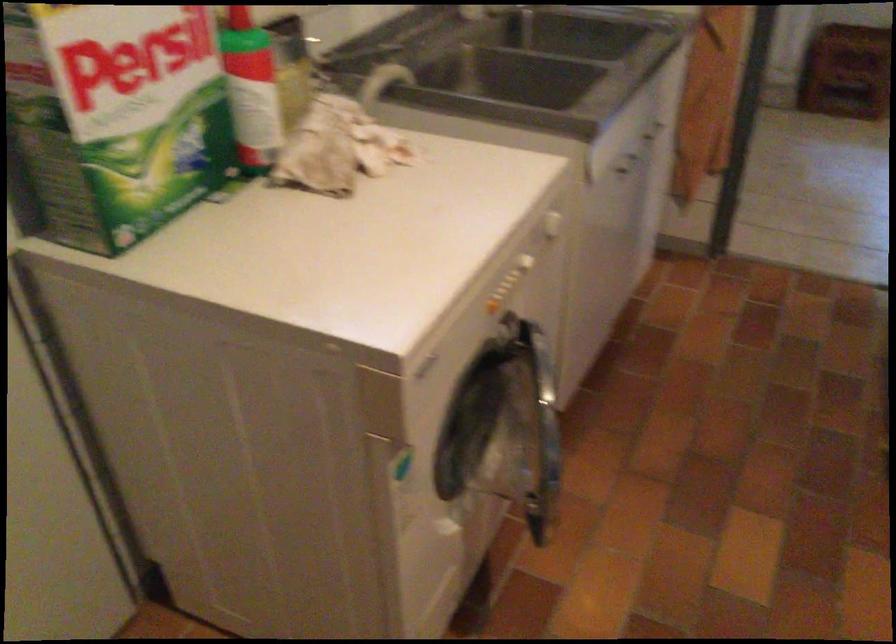
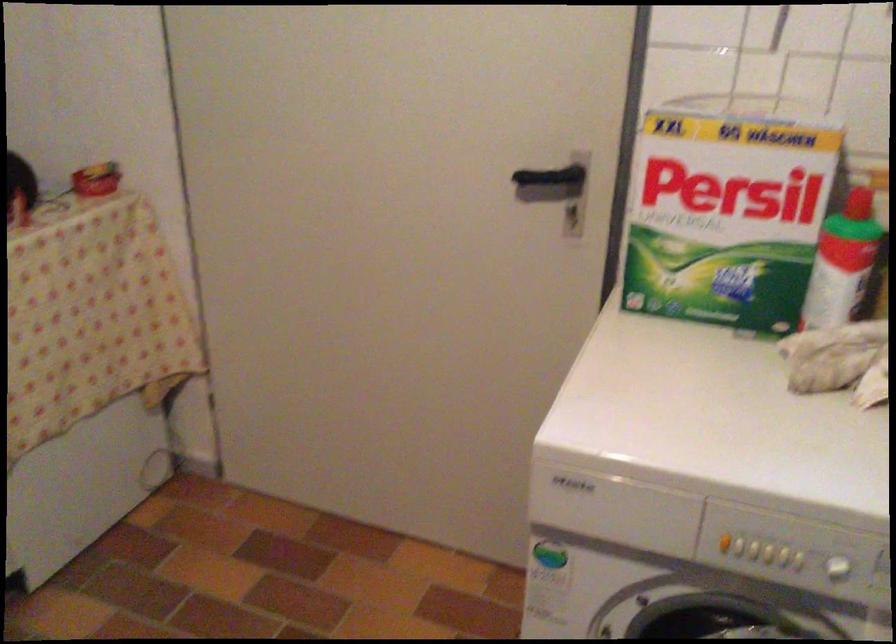
The point at (154, 86) is marked in the first image. Where is the corresponding point in the second image?

(728, 210)